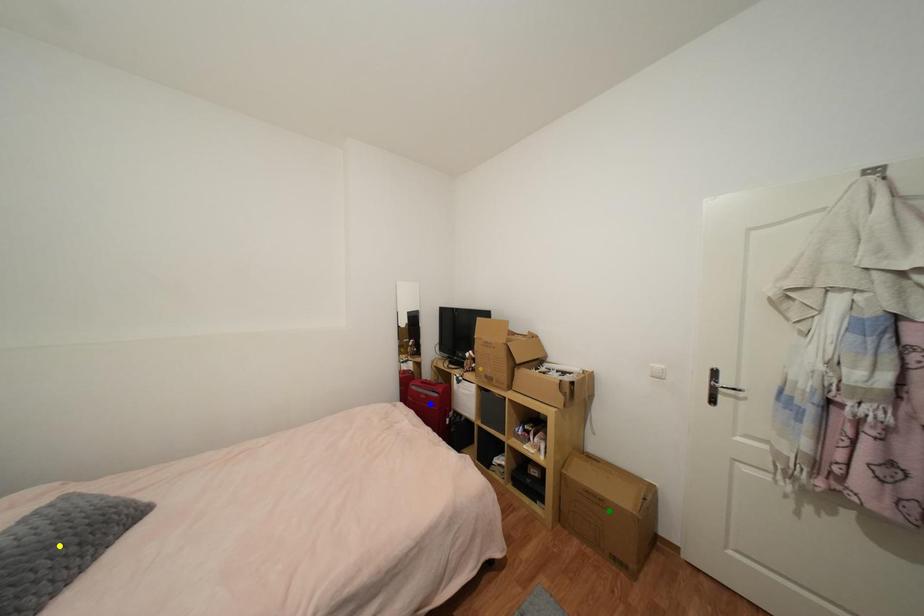
Order these from nearest to farthest:
yellow point
blue point
green point

1. yellow point
2. green point
3. blue point